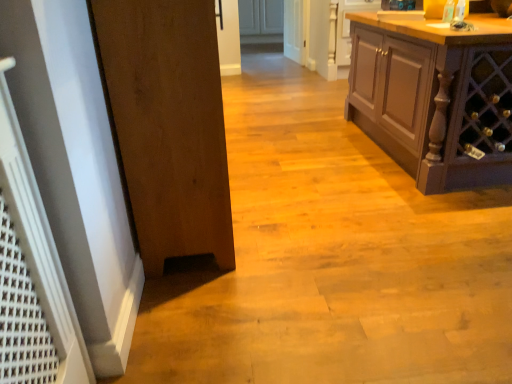
Locate an element on the screen. The width and height of the screenshot is (512, 384). space that is in front of wooden door at left is located at coordinates (271, 313).